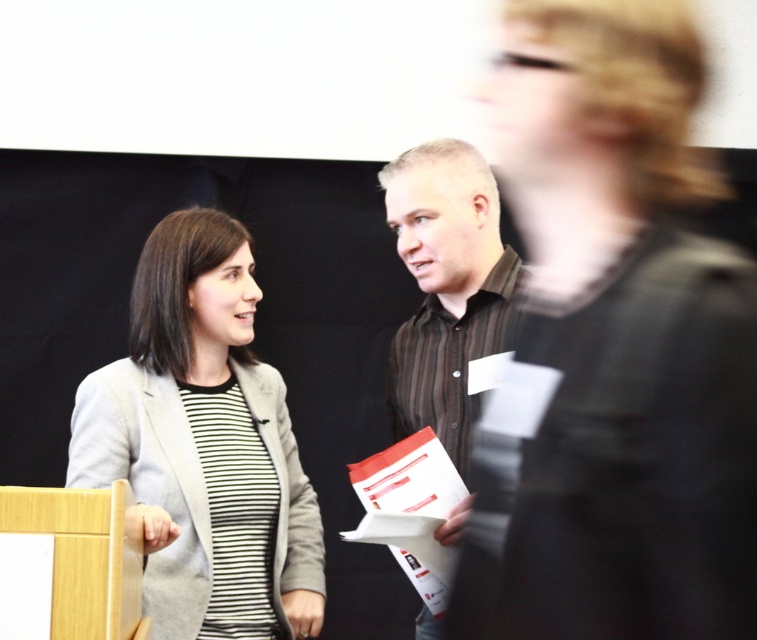
Question: Is matte gray blazer at center smaller than brown striped shirt at center?

Choices:
 (A) yes
 (B) no

Answer: (B)

Question: Is matte gray blazer at center wider than brown striped shirt at center?

Choices:
 (A) yes
 (B) no

Answer: (A)

Question: Which of the following is the closest to the observer?

Choices:
 (A) pos(129,468)
 (B) pos(481,396)

Answer: (A)

Question: Among these objects, which one is nearest to the camera?

Choices:
 (A) matte gray blazer at center
 (B) brown striped shirt at center

Answer: (A)

Question: Does matte gray blazer at center have a smaller size compared to brown striped shirt at center?

Choices:
 (A) yes
 (B) no

Answer: (B)